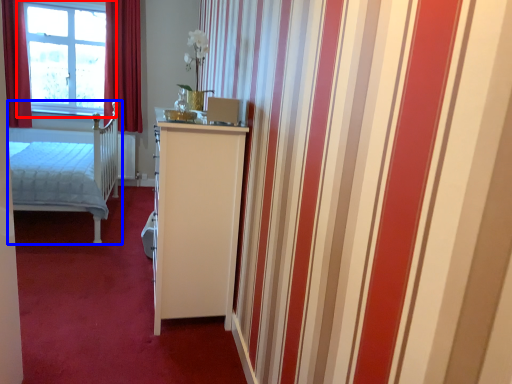
Question: Which object is closer to the camera taking this photo, window (highlighted by a red box) or bed (highlighted by a blue box)?

Choices:
 (A) window
 (B) bed

Answer: (B)